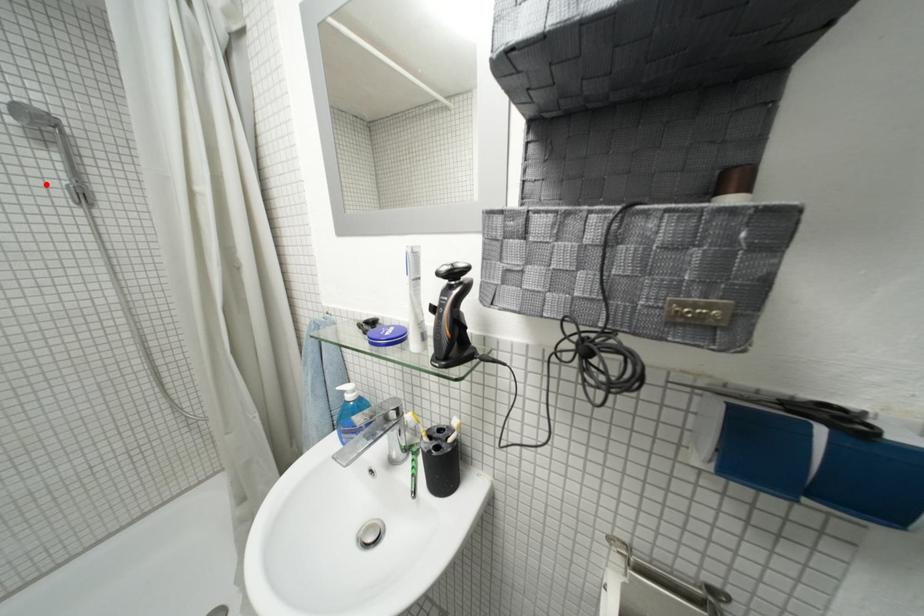
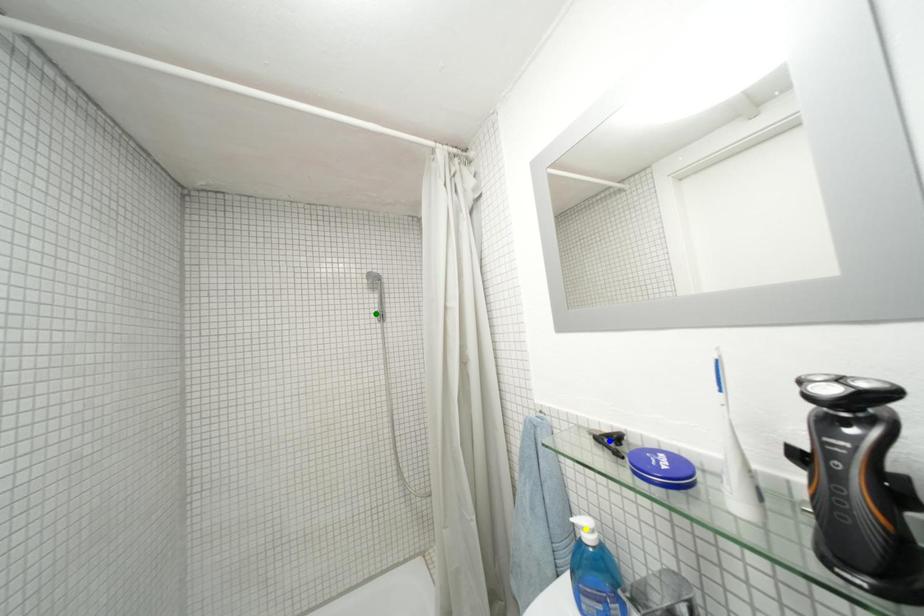
Question: I am providing you with two images of the same scene from different viewpoints. A red point is marked on the first image. You are given multiple points on the second image. Which point in image 2 represents the same 3d spot as the red point in image 1?

Choices:
 (A) yellow point
 (B) blue point
 (C) green point

Answer: (C)